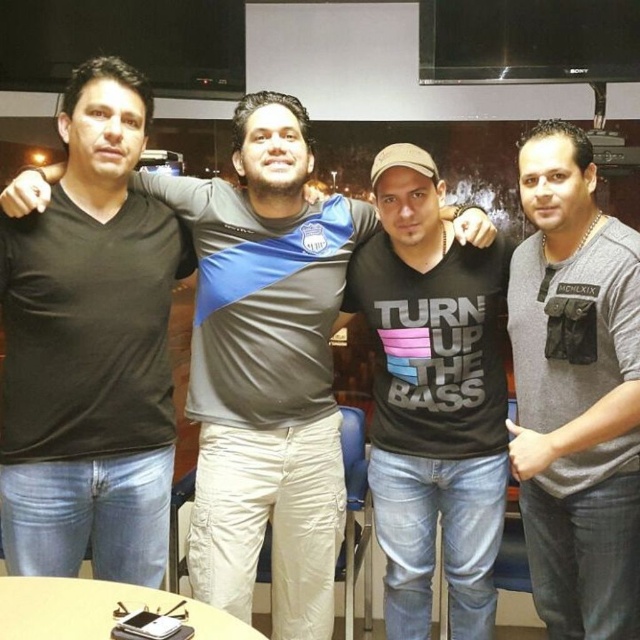
Which of these two, black matte shirt at center or black matte t-shirt at left, stands shorter?

black matte t-shirt at left

Can you confirm if black matte shirt at center is thinner than black matte t-shirt at left?

Incorrect, black matte shirt at center's width is not less than black matte t-shirt at left's.

This screenshot has width=640, height=640. Find the location of `black matte shirt at center`. black matte shirt at center is located at coordinates (266, 365).

In the scene shown: Is the position of black matte t-shirt at left more distant than that of gray matte shirt at right?

Yes.

Measure the distance from black matte t-shirt at left to gray matte shirt at right.

black matte t-shirt at left and gray matte shirt at right are 1.20 meters apart from each other.

Measure the distance between black matte t-shirt at left and camera.

black matte t-shirt at left and camera are 5.82 feet apart.

The width and height of the screenshot is (640, 640). Identify the location of black matte t-shirt at left. (90, 349).

Is point (83, 100) farther from viewer compared to point (454, 275)?

That is False.

Locate an element on the screen. This screenshot has height=640, width=640. black matte t-shirt at left is located at coordinates (90, 349).